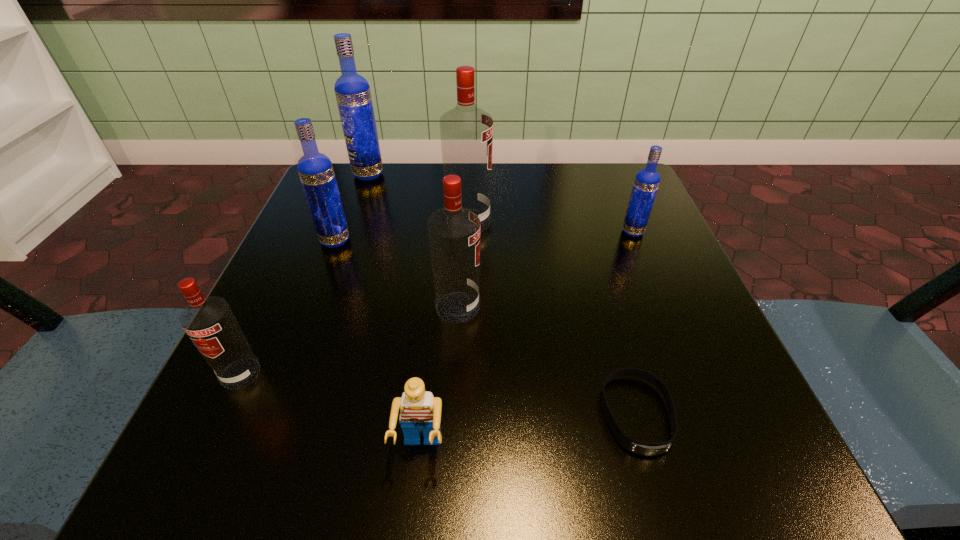
Where is `blue Lego`? The height and width of the screenshot is (540, 960). blue Lego is located at coordinates (420, 411).

The width and height of the screenshot is (960, 540). I want to click on the second shortest object, so click(x=420, y=411).

At what (x,y) coordinates should I click in order to perform the action: click on wristband. Please return your answer as a coordinate pair (x, y). Looking at the image, I should click on (643, 448).

The image size is (960, 540). I want to click on the shortest object, so click(x=643, y=448).

Identify the location of vacant space positioned 0.050m on the right of the farthest vodka. coord(405,175).

This screenshot has height=540, width=960. In order to click on vacant space located 0.120m on the front label of the biggest red vodka in this screenshot , I will do `click(550, 222)`.

Where is `vacant area situated on the front of the second biggest blue vodka`? Image resolution: width=960 pixels, height=540 pixels. vacant area situated on the front of the second biggest blue vodka is located at coordinates (254, 449).

Where is `vacant region located 0.240m on the front label of the fifth farthest vodka`? Image resolution: width=960 pixels, height=540 pixels. vacant region located 0.240m on the front label of the fifth farthest vodka is located at coordinates (626, 307).

I want to click on vacant space located 0.110m on the back of the smallest blue vodka, so click(617, 195).

Locate an element on the screen. The image size is (960, 540). vacant position located on the front label of the nearest vodka is located at coordinates (195, 470).